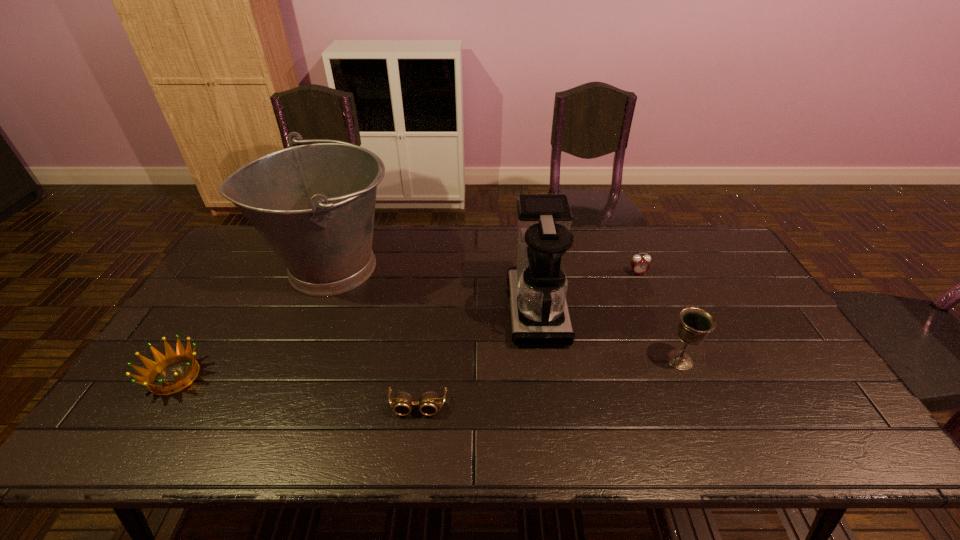
At what (x,y) coordinates should I click in order to perform the action: click on free space located at the front of the third object from right to left where the controls are located. Please return your answer as a coordinate pair (x, y). The width and height of the screenshot is (960, 540). Looking at the image, I should click on (416, 310).

At what (x,y) coordinates should I click in order to perform the action: click on free space located at the front of the third object from right to left where the controls are located. Please return your answer as a coordinate pair (x, y). Looking at the image, I should click on (483, 310).

At what (x,y) coordinates should I click in order to perform the action: click on vacant region located on the back of the chalice. Please return your answer as a coordinate pair (x, y). The width and height of the screenshot is (960, 540). Looking at the image, I should click on (660, 314).

This screenshot has width=960, height=540. I want to click on vacant space located on the clock face of the alarm clock, so click(660, 326).

Identify the location of vacant space located on the back of the crown. (228, 293).

The height and width of the screenshot is (540, 960). In order to click on free space located 0.070m through the lenses of the shortest object in this screenshot , I will do `click(413, 447)`.

This screenshot has height=540, width=960. I want to click on object present at the far edge, so click(314, 204).

Where is `bucket at the left edge`? The height and width of the screenshot is (540, 960). bucket at the left edge is located at coordinates (314, 204).

Locate an element on the screen. This screenshot has width=960, height=540. crown at the left edge is located at coordinates (161, 362).

In order to click on object that is at the far left corner in this screenshot , I will do `click(314, 204)`.